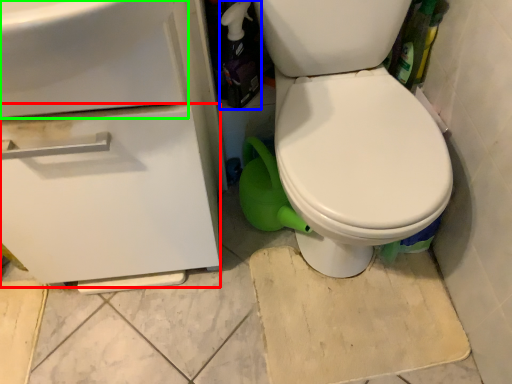
Question: Which is farther away from drawer (highlighted by a red box)? bottle (highlighted by a blue box) or sink (highlighted by a green box)?

Choices:
 (A) bottle
 (B) sink

Answer: (A)